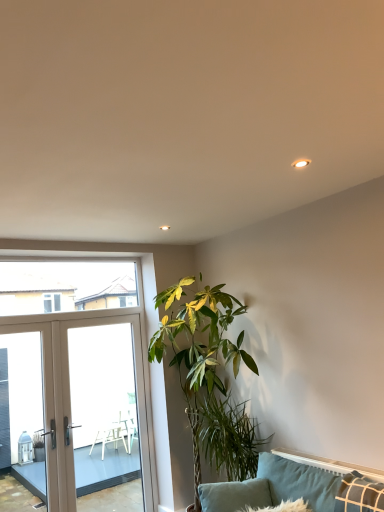
The height and width of the screenshot is (512, 384). Describe the element at coordinates (105, 406) in the screenshot. I see `white glossy screen door at left` at that location.

Describe the element at coordinates (65, 286) in the screenshot. I see `transparent glass window at upper left` at that location.

Where is `velvet teal pillow at lower right`? velvet teal pillow at lower right is located at coordinates click(x=298, y=482).

This screenshot has height=512, width=384. What are the coordinates of `green leafy plant at center` in the screenshot? It's located at (209, 378).

What is the approximate width of teal fabric couch at lower right?

teal fabric couch at lower right is 98.08 centimeters in width.

Locate an element on the screen. The height and width of the screenshot is (512, 384). green leafy plant at lower center is located at coordinates (225, 437).

Is beige glass door at left thinner than velvet teal pillow at lower right?

Indeed, beige glass door at left has a lesser width compared to velvet teal pillow at lower right.

Is beige glass door at left positioned with its back to velvet teal pillow at lower right?

beige glass door at left is not turned away from velvet teal pillow at lower right.

Is beige glass door at left positioned far away from velvet teal pillow at lower right?

Yes, beige glass door at left is far from velvet teal pillow at lower right.

Is green leafy plant at center at the back of green leafy plant at lower center?

Yes, green leafy plant at lower center's orientation is away from green leafy plant at center.

Consider the image. Does green leafy plant at lower center have a lesser height compared to green leafy plant at center?

Indeed, green leafy plant at lower center has a lesser height compared to green leafy plant at center.

From a real-world perspective, is green leafy plant at lower center positioned over green leafy plant at center based on gravity?

No.

Is green leafy plant at lower center far away from green leafy plant at center?

Actually, green leafy plant at lower center and green leafy plant at center are a little close together.

Between green leafy plant at center and velvet teal pillow at lower right, which one has larger size?

With larger size is green leafy plant at center.

Is green leafy plant at center positioned with its back to velvet teal pillow at lower right?

No, green leafy plant at center is not facing the opposite direction of velvet teal pillow at lower right.

In the scene shown: What's the angular difference between green leafy plant at center and velvet teal pillow at lower right's facing directions?

The facing directions of green leafy plant at center and velvet teal pillow at lower right are 73.1 degrees apart.

Is point (215, 296) behind point (295, 470)?

Yes, point (215, 296) is farther from viewer.

Considering the sizes of objects white glossy screen door at left and teal fabric couch at lower right in the image provided, who is shorter, white glossy screen door at left or teal fabric couch at lower right?

teal fabric couch at lower right.

Is white glossy screen door at left not near teal fabric couch at lower right?

Yes, white glossy screen door at left and teal fabric couch at lower right are quite far apart.

From the image's perspective, would you say white glossy screen door at left is positioned over teal fabric couch at lower right?

Correct, white glossy screen door at left appears higher than teal fabric couch at lower right in the image.

Considering the relative sizes of white glossy screen door at left and teal fabric couch at lower right in the image provided, is white glossy screen door at left thinner than teal fabric couch at lower right?

Correct, the width of white glossy screen door at left is less than that of teal fabric couch at lower right.

Is white glossy screen door at left oriented towards green leafy plant at center?

Yes, white glossy screen door at left is aimed at green leafy plant at center.

Considering the sizes of white glossy screen door at left and green leafy plant at center in the image, is white glossy screen door at left bigger or smaller than green leafy plant at center?

Considering their sizes, white glossy screen door at left takes up less space than green leafy plant at center.

Is white glossy screen door at left positioned far away from green leafy plant at center?

white glossy screen door at left is positioned a significant distance from green leafy plant at center.

Which is more to the right, white glossy screen door at left or green leafy plant at center?

From the viewer's perspective, green leafy plant at center appears more on the right side.

Between transparent glass window at upper left and green leafy plant at lower center, which one has larger width?

green leafy plant at lower center is wider.

Is transparent glass window at upper left outside of green leafy plant at lower center?

transparent glass window at upper left is positioned outside green leafy plant at lower center.

How different are the orientations of transparent glass window at upper left and green leafy plant at lower center in degrees?

They differ by 90.1 degrees in their facing directions.

Is transparent glass window at upper left facing away from green leafy plant at lower center?

That's not correct — transparent glass window at upper left is not looking away from green leafy plant at lower center.

Considering the sizes of objects velvet teal pillow at lower right and transparent glass window at upper left in the image provided, who is thinner, velvet teal pillow at lower right or transparent glass window at upper left?

transparent glass window at upper left.

Which is behind, point (315, 467) or point (111, 290)?

Positioned behind is point (111, 290).

What are the coordinates of `window on the left of velvet teal pillow at lower right` in the screenshot? It's located at (74, 379).

Find the location of a particular element. Image resolution: width=384 pixels, height=512 pixels. houseplant located above the green leafy plant at lower center (from a real-world perspective) is located at coordinates (209, 378).

From the image, which object appears to be farther from green leafy plant at center, beige glass door at left or velvet teal pillow at lower right?

beige glass door at left.

Based on their spatial positions, is green leafy plant at center or white glossy screen door at left further from teal fabric couch at lower right?

white glossy screen door at left is further to teal fabric couch at lower right.

Looking at the image, which one is located closer to transparent glass window at upper left, velvet teal pillow at lower right or beige glass door at left?

beige glass door at left is positioned closer to the anchor transparent glass window at upper left.

Which object lies nearer to the anchor point beige glass door at left, teal fabric couch at lower right or transparent glass window at upper left?

transparent glass window at upper left is closer to beige glass door at left.

Looking at the image, which one is located further to green leafy plant at lower center, transparent glass window at upper left or white glossy screen door at left?

Based on the image, white glossy screen door at left appears to be further to green leafy plant at lower center.

Based on the photo, based on their spatial positions, is velvet teal pillow at lower right or green leafy plant at center further from transparent glass window at upper left?

Among the two, velvet teal pillow at lower right is located further to transparent glass window at upper left.

Consider the image. Considering their positions, is white glossy screen door at left positioned closer to beige glass door at left than transparent glass window at upper left?

Among the two, transparent glass window at upper left is located nearer to beige glass door at left.

From the picture: Considering their positions, is green leafy plant at lower center positioned further to transparent glass window at upper left than teal fabric couch at lower right?

Based on the image, teal fabric couch at lower right appears to be further to transparent glass window at upper left.

Locate an element on the screen. The image size is (384, 512). screen door between beige glass door at left and velvet teal pillow at lower right is located at coordinates (105, 406).

At what (x,y) coordinates should I click in order to perform the action: click on houseplant located between teal fabric couch at lower right and white glossy screen door at left in the depth direction. Please return your answer as a coordinate pair (x, y). Looking at the image, I should click on (209, 378).

Find the location of `window between transparent glass window at upper left and green leafy plant at lower center from left to right`. window between transparent glass window at upper left and green leafy plant at lower center from left to right is located at coordinates (74, 379).

In order to click on screen door located between transparent glass window at upper left and velvet teal pillow at lower right in the left-right direction in this screenshot , I will do (x=105, y=406).